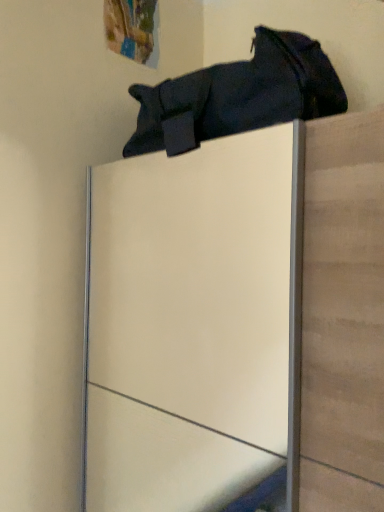
Where is `white glossy cabinet at upper center`? This screenshot has height=512, width=384. white glossy cabinet at upper center is located at coordinates (194, 325).

What do you see at coordinates (194, 325) in the screenshot?
I see `white glossy cabinet at upper center` at bounding box center [194, 325].

Describe the element at coordinates (238, 95) in the screenshot. I see `dark fabric bag at upper center` at that location.

Find the location of a particular element. The width and height of the screenshot is (384, 512). dark fabric bag at upper center is located at coordinates (238, 95).

Where is `white glossy cabinet at upper center`? white glossy cabinet at upper center is located at coordinates (194, 325).

In the image, is white glossy cabinet at upper center on the left side or the right side of dark fabric bag at upper center?

Based on their positions, white glossy cabinet at upper center is located to the right of dark fabric bag at upper center.

Considering their positions, is white glossy cabinet at upper center located in front of or behind dark fabric bag at upper center?

Visually, white glossy cabinet at upper center is located in front of dark fabric bag at upper center.

Does point (111, 393) come behind point (165, 96)?

Yes.

From the image's perspective, is white glossy cabinet at upper center positioned above or below dark fabric bag at upper center?

From the image's perspective, white glossy cabinet at upper center appears below dark fabric bag at upper center.

From a real-world perspective, is white glossy cabinet at upper center over dark fabric bag at upper center?

No, from a real-world perspective, white glossy cabinet at upper center is not over dark fabric bag at upper center

Between white glossy cabinet at upper center and dark fabric bag at upper center, which one has larger width?

With larger width is white glossy cabinet at upper center.

Can you confirm if white glossy cabinet at upper center is taller than dark fabric bag at upper center?

Correct, white glossy cabinet at upper center is much taller as dark fabric bag at upper center.

Does white glossy cabinet at upper center have a smaller size compared to dark fabric bag at upper center?

Actually, white glossy cabinet at upper center might be larger than dark fabric bag at upper center.

Is white glossy cabinet at upper center completely or partially outside of dark fabric bag at upper center?

Yes, white glossy cabinet at upper center is outside of dark fabric bag at upper center.

Is white glossy cabinet at upper center in contact with dark fabric bag at upper center?

white glossy cabinet at upper center and dark fabric bag at upper center are clearly separated.

Does white glossy cabinet at upper center turn towards dark fabric bag at upper center?

No.

How different are the orientations of white glossy cabinet at upper center and dark fabric bag at upper center in degrees?

The angle between the facing direction of white glossy cabinet at upper center and the facing direction of dark fabric bag at upper center is 2.82 degrees.

Where is `footwear behind the white glossy cabinet at upper center`? This screenshot has height=512, width=384. footwear behind the white glossy cabinet at upper center is located at coordinates click(238, 95).

Considering the relative positions of dark fabric bag at upper center and white glossy cabinet at upper center in the image provided, is dark fabric bag at upper center to the left or to the right of white glossy cabinet at upper center?

Clearly, dark fabric bag at upper center is on the left of white glossy cabinet at upper center in the image.

Is dark fabric bag at upper center in front of or behind white glossy cabinet at upper center in the image?

Clearly, dark fabric bag at upper center is behind white glossy cabinet at upper center.

Does point (275, 52) come behind point (192, 267)?

No, (275, 52) is closer to viewer.

From the image's perspective, is dark fabric bag at upper center above or below white glossy cabinet at upper center?

Based on their image positions, dark fabric bag at upper center is located above white glossy cabinet at upper center.

From a real-world perspective, between dark fabric bag at upper center and white glossy cabinet at upper center, who is vertically lower?

white glossy cabinet at upper center.

Considering the relative sizes of dark fabric bag at upper center and white glossy cabinet at upper center in the image provided, is dark fabric bag at upper center thinner than white glossy cabinet at upper center?

Indeed, dark fabric bag at upper center has a lesser width compared to white glossy cabinet at upper center.

Considering the relative sizes of dark fabric bag at upper center and white glossy cabinet at upper center in the image provided, is dark fabric bag at upper center shorter than white glossy cabinet at upper center?

Indeed, dark fabric bag at upper center has a lesser height compared to white glossy cabinet at upper center.

In terms of size, does dark fabric bag at upper center appear bigger or smaller than white glossy cabinet at upper center?

Considering their sizes, dark fabric bag at upper center takes up less space than white glossy cabinet at upper center.

Is dark fabric bag at upper center inside or outside of white glossy cabinet at upper center?

dark fabric bag at upper center is spatially situated outside white glossy cabinet at upper center.

Is dark fabric bag at upper center not near white glossy cabinet at upper center?

No.

Is dark fabric bag at upper center facing towards white glossy cabinet at upper center?

No, dark fabric bag at upper center is not aimed at white glossy cabinet at upper center.

I want to click on glass door below the dark fabric bag at upper center (from the image's perspective), so click(x=194, y=325).

You are a GUI agent. You are given a task and a screenshot of the screen. Output one action in this format:
    pyautogui.click(x=<x>, y=<y>)
    Task: Click on the glass door in front of the dark fabric bag at upper center
    
    Given the screenshot: What is the action you would take?
    pyautogui.click(x=194, y=325)

I want to click on glass door lying below the dark fabric bag at upper center (from the image's perspective), so click(x=194, y=325).